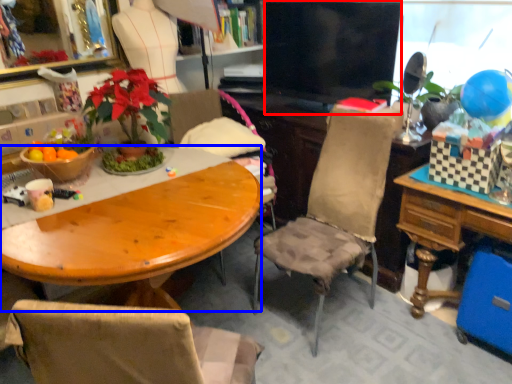
Question: Which of the following is the farthest to the observer, television (highlighted by a red box) or desk (highlighted by a blue box)?

Choices:
 (A) television
 (B) desk

Answer: (A)